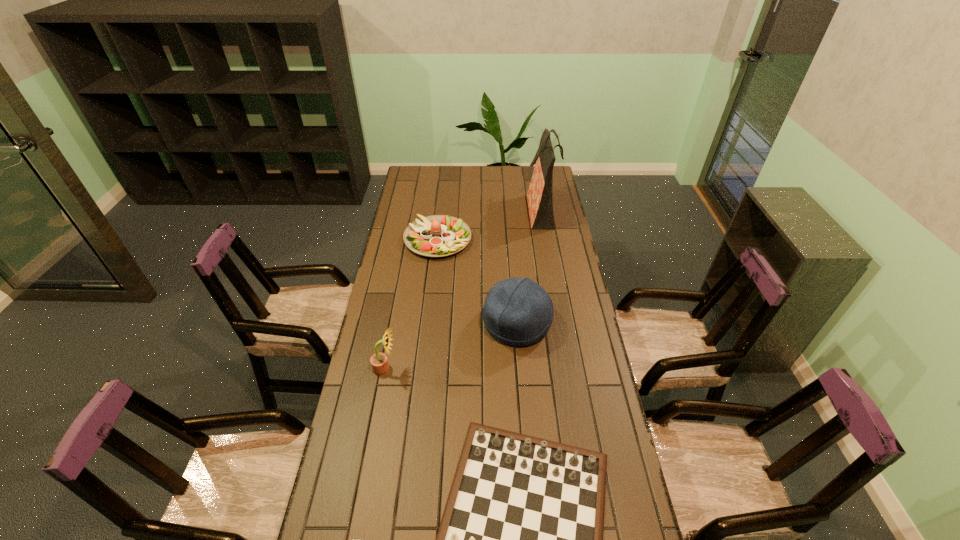
The image size is (960, 540). I want to click on sunflower positioned at the left edge, so click(379, 362).

The height and width of the screenshot is (540, 960). I want to click on salad plate present at the left edge, so click(438, 235).

The image size is (960, 540). Identify the location of shopping bag present at the right edge. (540, 193).

Image resolution: width=960 pixels, height=540 pixels. In order to click on skullcap at the right edge in this screenshot , I will do `click(518, 312)`.

The width and height of the screenshot is (960, 540). What are the coordinates of `vacant area at the far edge of the desktop` in the screenshot? It's located at (491, 184).

The width and height of the screenshot is (960, 540). In the image, there is a desktop. Identify the location of vacant space at the left edge. (347, 478).

In the image, there is a desktop. Where is `free space at the right edge`? The image size is (960, 540). free space at the right edge is located at coordinates (574, 361).

This screenshot has width=960, height=540. In the image, there is a desktop. What are the coordinates of `vacant space at the far right corner` in the screenshot? It's located at (530, 168).

In order to click on vacant point located between the tallest object and the sunflower in this screenshot , I will do [463, 289].

The width and height of the screenshot is (960, 540). I want to click on free point between the sunflower and the third farthest object, so click(x=451, y=346).